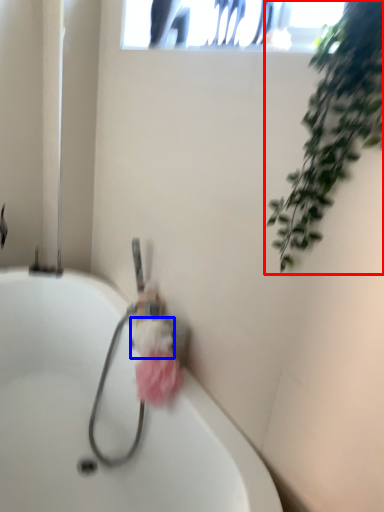
Question: Which object is closer to the camera taking this photo, houseplant (highlighted by a red box) or flower (highlighted by a blue box)?

Choices:
 (A) houseplant
 (B) flower

Answer: (A)